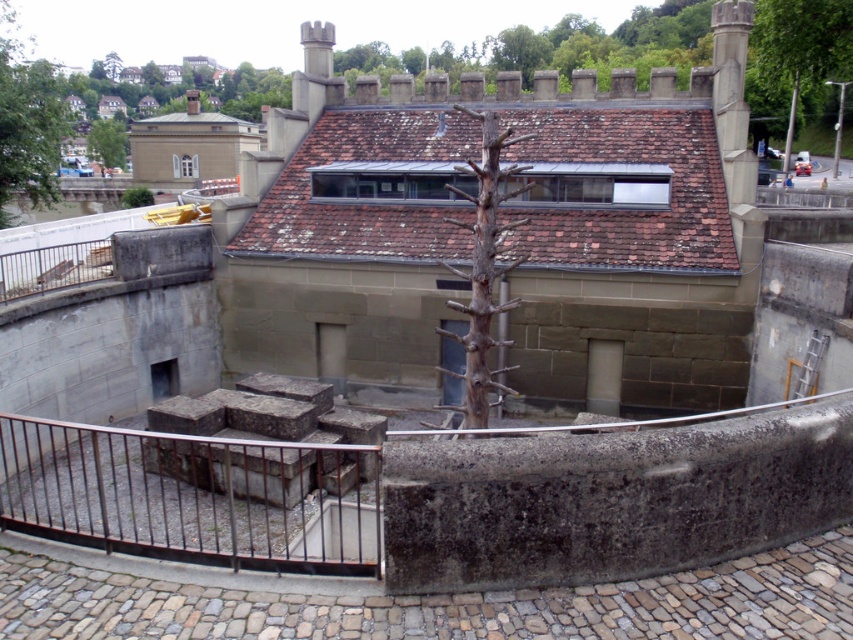
Question: Which point is farther from the camera taking this photo?

Choices:
 (A) (36, 99)
 (B) (103, 125)
 (C) (463, 337)
 (D) (302, 458)

Answer: (B)

Question: Considering the real-world distances, which object is closest to the rusty metal railing at lower left?

Choices:
 (A) brown rough wood tree at center
 (B) green leafy tree at upper left

Answer: (A)

Question: Is green leafy tree at upper left closer to the viewer compared to bare wood tree at upper center?

Choices:
 (A) no
 (B) yes

Answer: (B)

Question: Can you confirm if rusty metal railing at lower left is wider than green leafy tree at upper left?

Choices:
 (A) yes
 (B) no

Answer: (A)

Question: Does rusty metal railing at lower left come in front of bare wood tree at upper center?

Choices:
 (A) yes
 (B) no

Answer: (A)

Question: Which object is closer to the camera taking this photo?

Choices:
 (A) bare wood tree at upper center
 (B) green leafy tree at upper left
 (C) brown rough wood tree at center

Answer: (C)